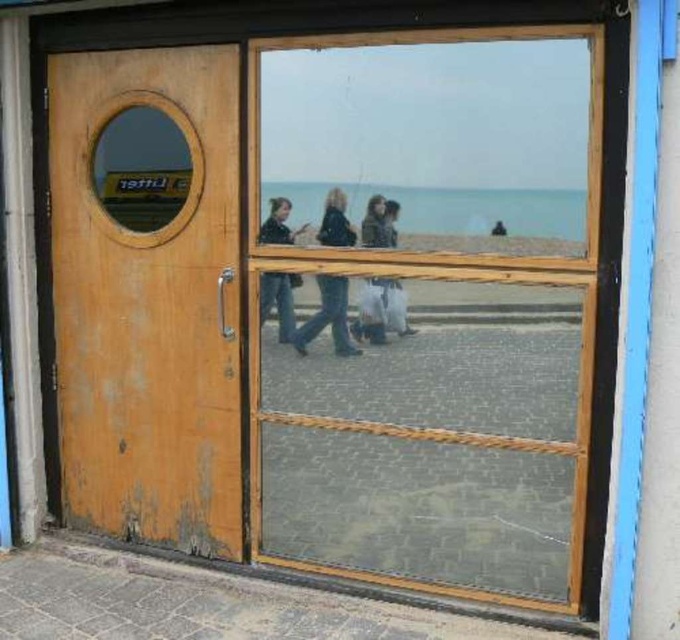
Looking at this image, you are standing in front of the wooden door with a circular window and see two items at the center of the scene. Which item is taller between the dark blue jeans at center and the dark brown leather jacket at center?

The dark blue jeans at center is taller than the dark brown leather jacket at center.

You are standing in front of the wooden door with a circular window. You see a transparent glass door at center and a dark brown leather jacket at center. Which object is closer to you?

The transparent glass door at center is closer to you because it is in front of the dark brown leather jacket at center.

You are standing in front of the wooden door with a circular window and a rectangular handle. You notice two points marked on the door frame. The first point is at coordinates point (375, 364) and the second point is at point (377, 216). Which point is closer to you?

Point (377, 216) is closer to you because it is less further than point (375, 364) which is further away according to the description.